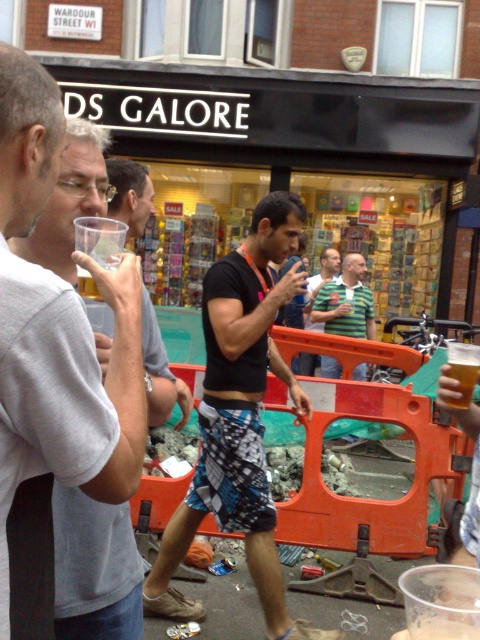
Question: Which of the following is the farthest from the observer?

Choices:
 (A) black matte shirt at center
 (B) translucent plastic cup at center

Answer: (A)

Question: Does white matte cup at upper left have a lesser width compared to striped cotton shirt at center?

Choices:
 (A) yes
 (B) no

Answer: (A)

Question: Can you confirm if black matte shirt at center is positioned above clear plastic cup at center?

Choices:
 (A) yes
 (B) no

Answer: (A)

Question: Estimate the real-world distances between objects in this image. Which object is farther from the white matte cup at upper left?

Choices:
 (A) striped cotton shirt at center
 (B) clear plastic cup at center

Answer: (A)

Question: Can you confirm if striped cotton shirt at center is thinner than translucent plastic cup at center?

Choices:
 (A) no
 (B) yes

Answer: (A)

Question: Based on their relative distances, which object is farther from the striped cotton shirt at center?

Choices:
 (A) clear plastic cup at center
 (B) translucent plastic cup at center

Answer: (A)